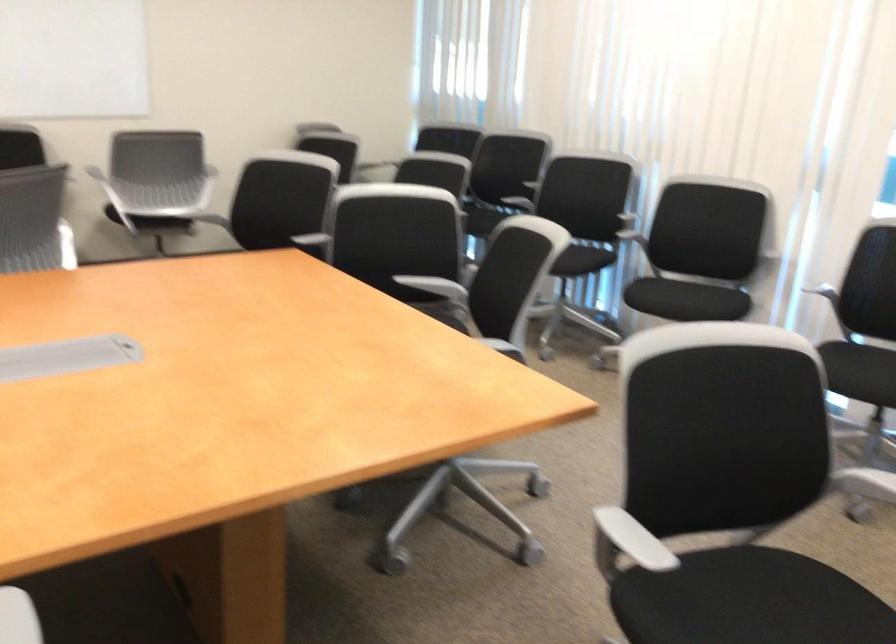
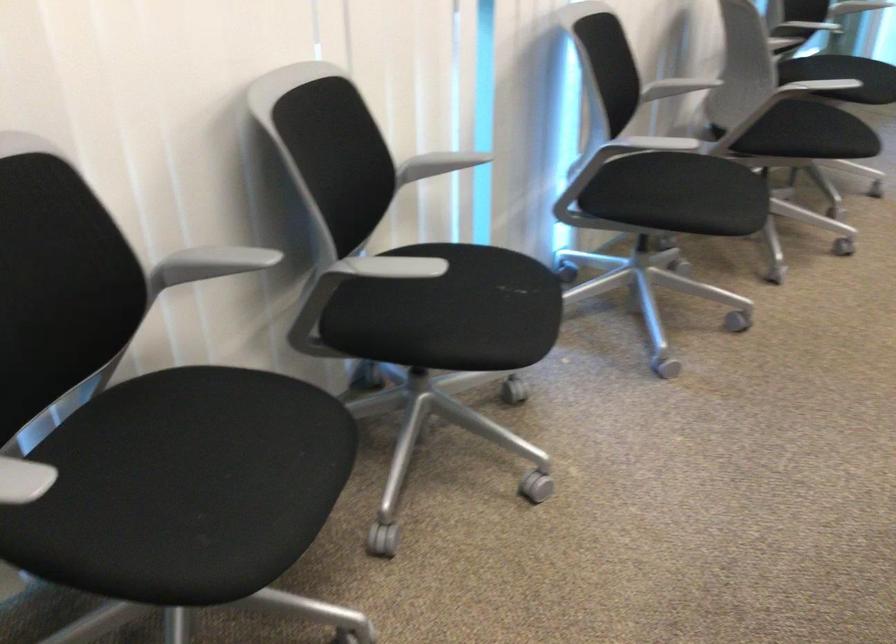
The point at (770,247) is marked in the first image. Where is the corresponding point in the second image?

(438, 164)